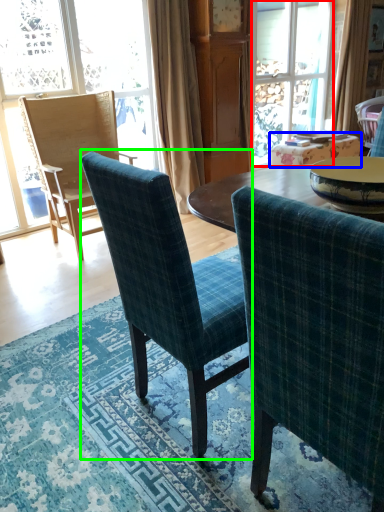
Question: Considering the real-world distances, which object is farthest from glass door (highlighted by a red box)? table (highlighted by a blue box) or chair (highlighted by a green box)?

Choices:
 (A) table
 (B) chair

Answer: (B)